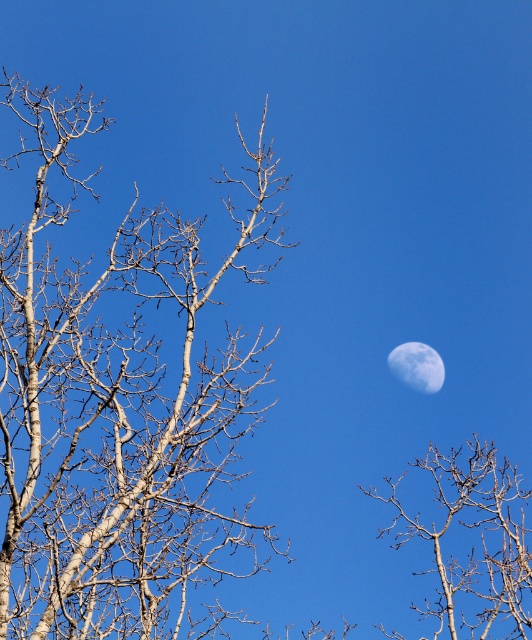
Question: Which object is farther from the camera taking this photo?

Choices:
 (A) smooth white moon at upper right
 (B) smooth bark tree at right

Answer: (A)

Question: Which object is the farthest from the smooth bark tree at right?

Choices:
 (A) white smooth birch tree at left
 (B) smooth white moon at upper right

Answer: (A)

Question: Which of the following is the closest to the observer?

Choices:
 (A) smooth white moon at upper right
 (B) smooth bark tree at right

Answer: (B)

Question: Can you confirm if smooth bark tree at right is wider than smooth white moon at upper right?

Choices:
 (A) no
 (B) yes

Answer: (B)

Question: Is white smooth birch tree at left positioned before smooth white moon at upper right?

Choices:
 (A) yes
 (B) no

Answer: (A)

Question: In this image, where is smooth bark tree at right located relative to smooth white moon at upper right?

Choices:
 (A) right
 (B) left

Answer: (A)